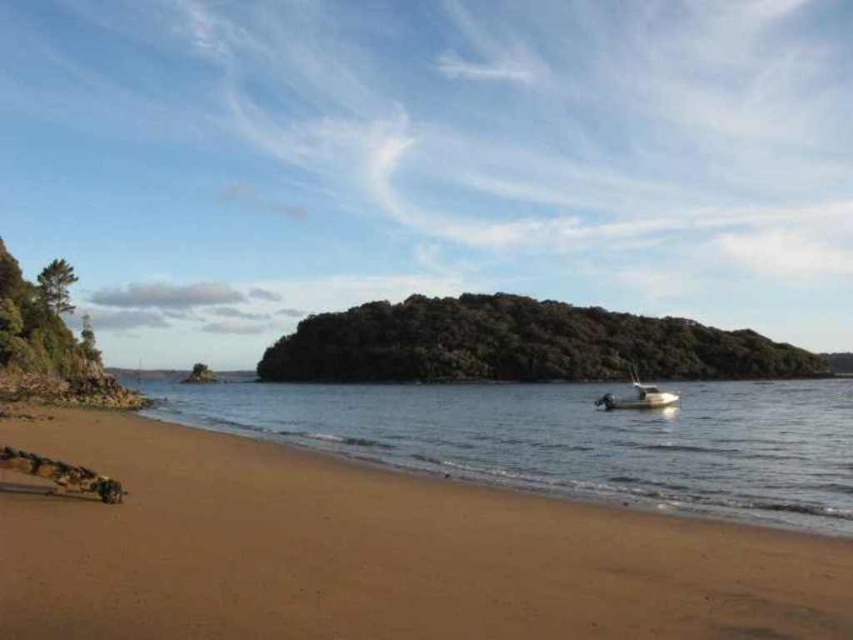
Based on the photo, you are a photographer planning to capture the sandy beach at lower left and the green leafy island at center in a single frame. Considering their sizes in the image, which object will require you to adjust your camera angle to ensure both are fully visible?

The sandy beach at lower left occupies less space than the green leafy island at center, so you will need to adjust your camera angle to accommodate the larger size of the green leafy island at center while ensuring the smaller sandy beach at lower left remains in frame.

You are a sailor navigating a small boat in the image. You see the green leafy island at center and the white plastic boat at lower right. Which direction should you steer to reach the island from the boat?

You should steer to the left to reach the green leafy island at center from the white plastic boat at lower right because the green leafy island at center is located to the left of the white plastic boat at lower right.

Consider the image. You are standing on the sandy beach at lower left and want to reach the white plastic boat at lower right. Which direction should you move to get closer to the boat?

You should move towards the lower right direction to get closer to the white plastic boat at lower right since the sandy beach at lower left is above it.